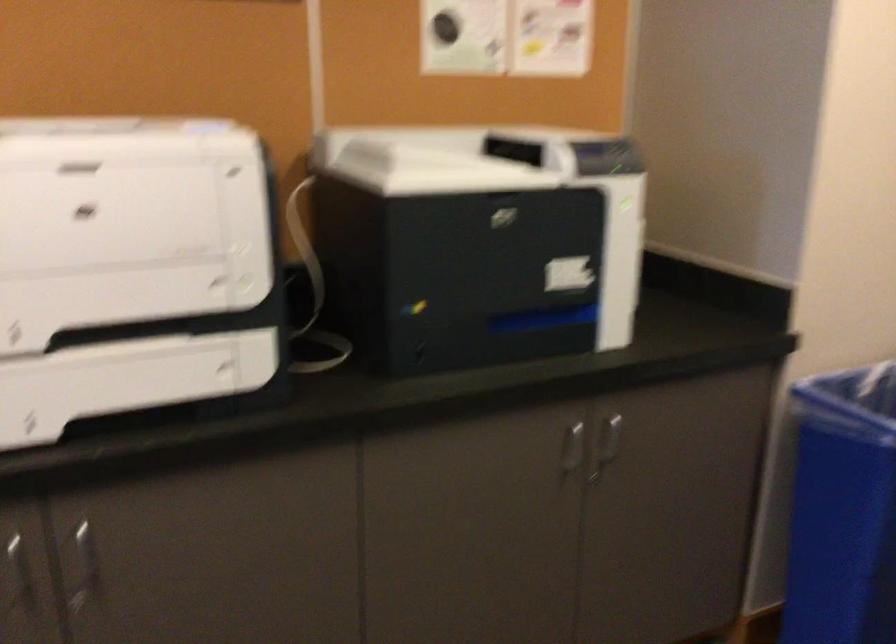
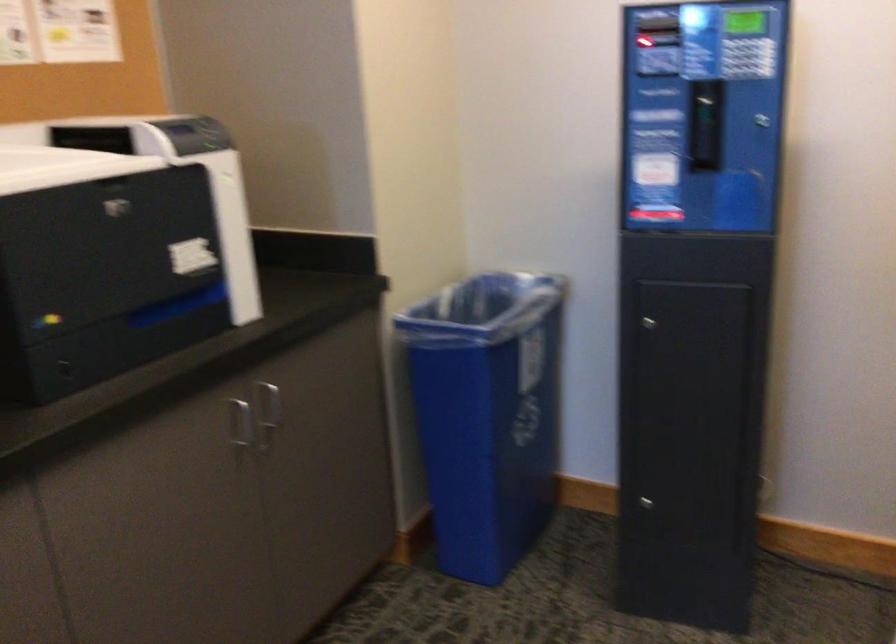
The point at [567,450] is marked in the first image. Where is the corresponding point in the second image?

(239, 424)